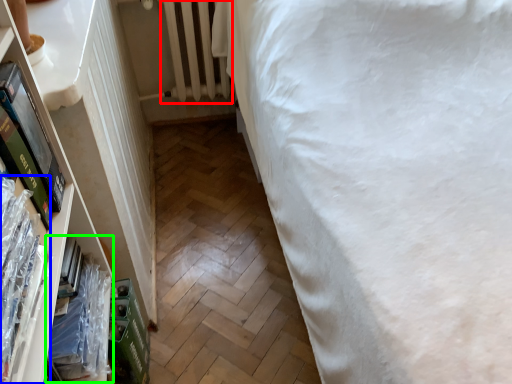
Question: Considering the real-world distances, which object is farthest from radiator (highlighted by a red box)? book (highlighted by a blue box) or book (highlighted by a green box)?

Choices:
 (A) book
 (B) book

Answer: (A)